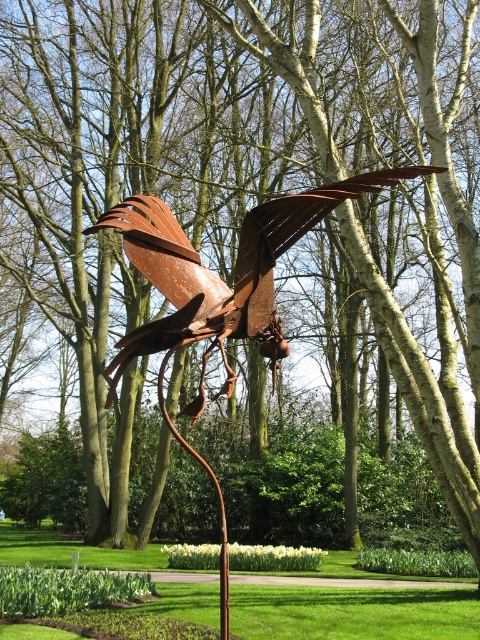
You are standing in the park and want to take a photo of the metal bird sculpture. The camera you have can focus on objects up to 6 meters away. Is the point at coordinates point [272,246] within the camera focus range?

The distance between point [272,246] and the viewer is 5.72 meters, which is within the camera focus range of up to 6 meters. Therefore, the camera can focus on the point at coordinates point [272,246].

You are standing in the park and want to take a photo of both the rusty metal bird at center and the rusty metal sculpture at center. Can you fit both in your camera frame if your camera has a maximum focus range of 10 meters?

The rusty metal bird at center is 9.90 meters away from the rusty metal sculpture at center. Since the camera can focus up to 10 meters, both objects are within the maximum focus range and can be captured in the same frame.

You are a park visitor standing in front of the sculpture. You notice two objects labeled as the rusty metal bird at center and the rusty metal sculpture at center. Which one is placed higher in the image?

The rusty metal bird at center is positioned over the rusty metal sculpture at center, so it is higher.